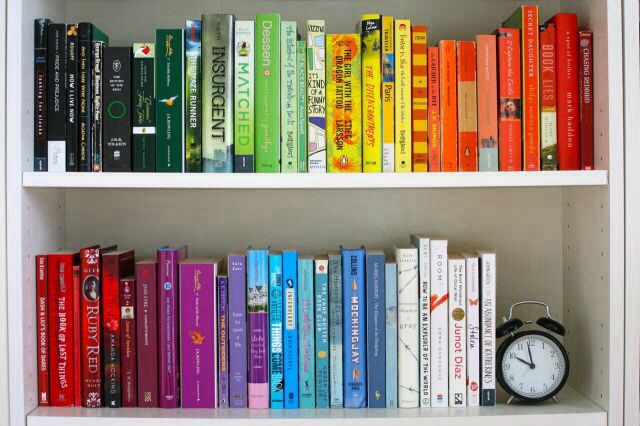
Find the location of `red books`. red books is located at coordinates (42, 363), (56, 350), (72, 357), (88, 336), (112, 309).